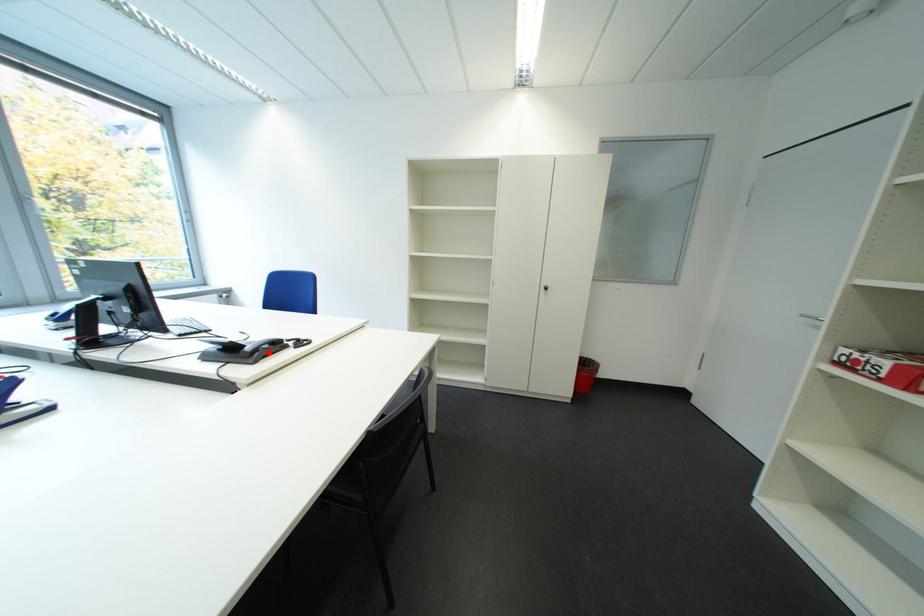
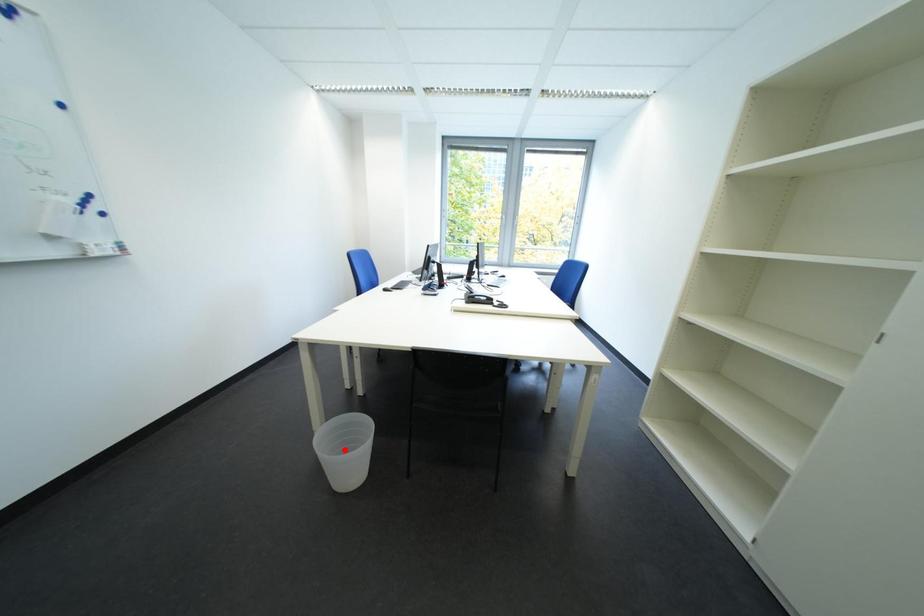
I am providing you with two images of the same scene from different viewpoints. A red point is marked on the first image and another point is marked on the second image. Do the highlighted points in image1 and image2 indicate the same real-world spot?

No